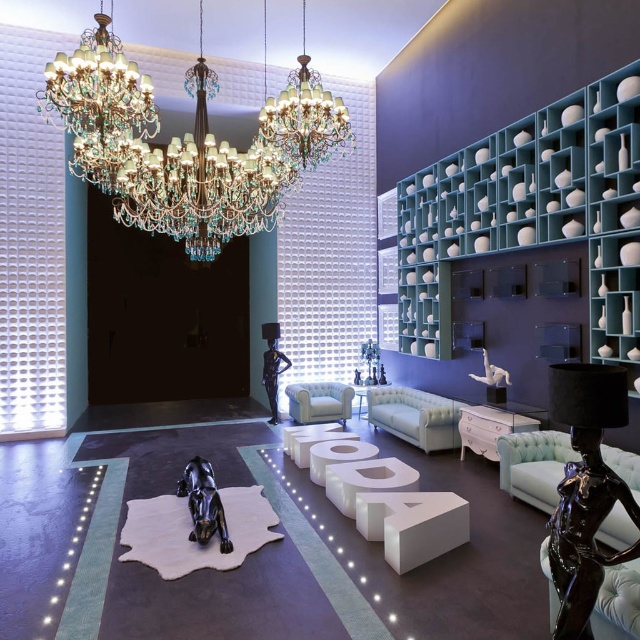
Who is more forward, (321, 161) or (211, 531)?

Point (211, 531) is more forward.

Does point (308, 76) come in front of point (218, 529)?

That is False.

Who is more forward, (268,138) or (193,500)?

Point (193,500) is more forward.

Where is `crystal chandelier at upper center`? This screenshot has height=640, width=640. crystal chandelier at upper center is located at coordinates (305, 116).

Is the position of crystal chandelier at upper center less distant than that of white glossy dresser at lower right?

Yes, crystal chandelier at upper center is in front of white glossy dresser at lower right.

Is point (266, 99) positioned before point (492, 445)?

No, it is not.

Measure the distance between point (323,148) and camera.

Point (323,148) is 5.02 meters from camera.

Where is `crystal chandelier at upper center`? The height and width of the screenshot is (640, 640). crystal chandelier at upper center is located at coordinates (305, 116).

I want to click on black glossy sculpture at center, so click(204, 502).

Between black glossy sculpture at center and white glossy dresser at lower right, which one appears on the left side from the viewer's perspective?

Positioned to the left is black glossy sculpture at center.

Is point (198, 476) positioned before point (484, 410)?

Yes, point (198, 476) is in front of point (484, 410).

At what (x,y) coordinates should I click in order to perform the action: click on black glossy sculpture at center. Please return your answer as a coordinate pair (x, y). This screenshot has width=640, height=640. Looking at the image, I should click on (204, 502).